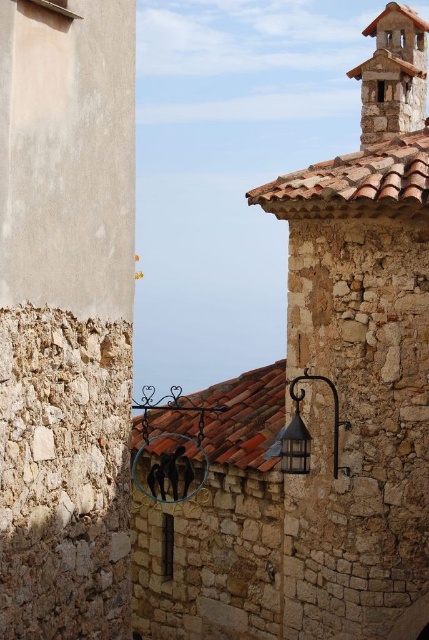
You are an architect designing a new lighting system for the stone building. You need to place a new lantern that is exactly the same size as the existing matte black lantern at center. Where should you position the new lantern so that it does not exceed the width of the stone bell tower at upper right?

The stone bell tower at upper right is wider than the matte black lantern at center. Therefore, placing the new lantern anywhere within the width of the stone bell tower at upper right will ensure it does not exceed its width.

You are standing in front of a rustic stone building. You see a brown tile roof at center and a matte black lantern at center. Which object is positioned to the left?

The brown tile roof at center is to the left of the matte black lantern at center.